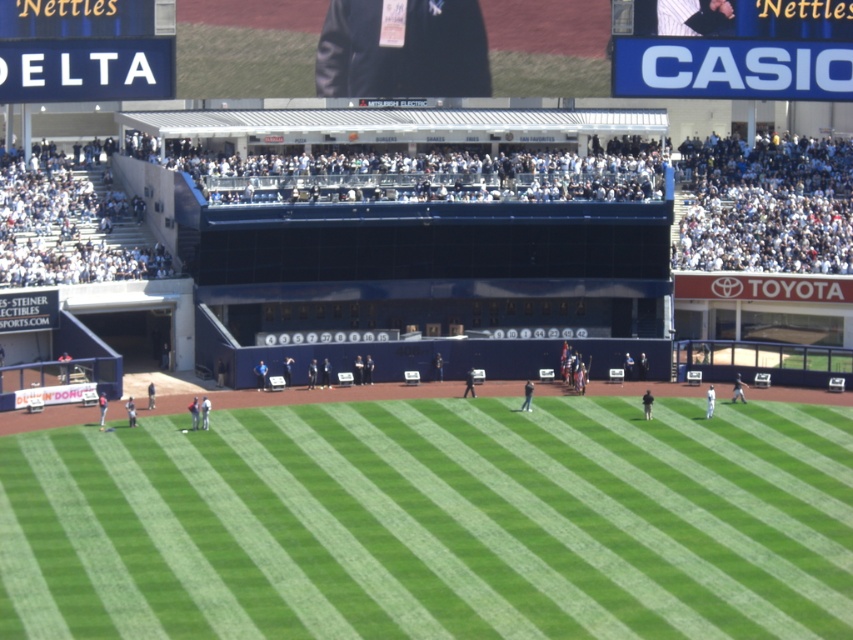
Question: Does green grass at center have a lesser width compared to blue plastic sign at upper left?

Choices:
 (A) yes
 (B) no

Answer: (B)

Question: Is blue plastic sign at upper center bigger than blue plastic sign at upper left?

Choices:
 (A) yes
 (B) no

Answer: (A)

Question: Among these points, which one is farthest from the camera?

Choices:
 (A) (706, 632)
 (B) (833, 16)
 (C) (100, 8)

Answer: (B)

Question: Which object is farther from the camera taking this photo?

Choices:
 (A) blue plastic sign at upper center
 (B) blue plastic sign at upper left
 (C) green grass at center

Answer: (A)

Question: Is green grass at center smaller than blue plastic sign at upper left?

Choices:
 (A) no
 (B) yes

Answer: (A)

Question: Which is farther from the blue plastic sign at upper left?

Choices:
 (A) green grass at center
 (B) blue plastic sign at upper center

Answer: (A)